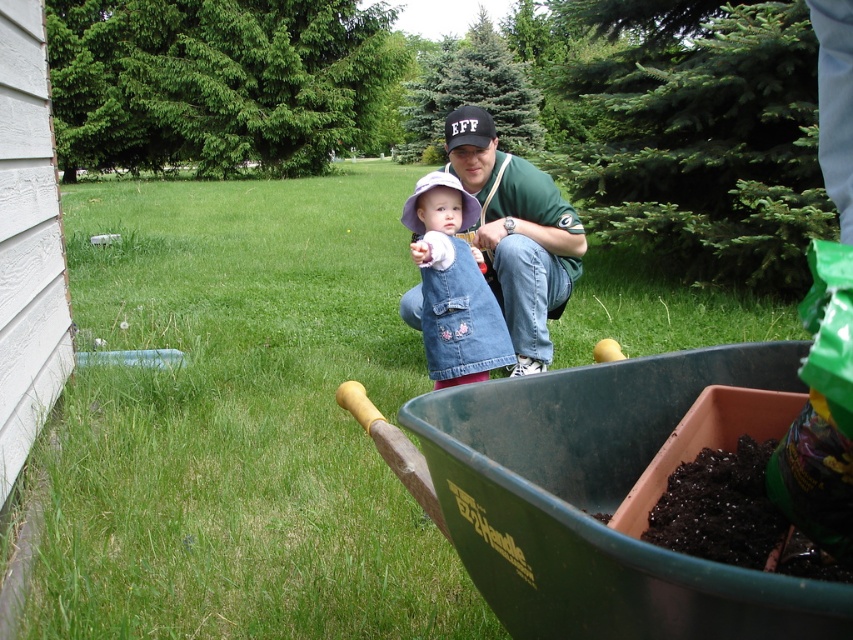
Question: Based on their relative distances, which object is farther from the green grass at lower left?

Choices:
 (A) denim vest at center
 (B) green jersey at center

Answer: (B)

Question: Is green grass at lower left positioned before green jersey at center?

Choices:
 (A) no
 (B) yes

Answer: (B)

Question: Which point appears farthest from the camera in this image?

Choices:
 (A) (534, 346)
 (B) (427, 211)

Answer: (A)

Question: Is green grass at lower left thinner than denim vest at center?

Choices:
 (A) no
 (B) yes

Answer: (A)

Question: Which point is closer to the camera?

Choices:
 (A) (466, 259)
 (B) (492, 230)
 (C) (219, 588)

Answer: (C)

Question: From the image, what is the correct spatial relationship of green grass at lower left in relation to denim vest at center?

Choices:
 (A) right
 (B) left

Answer: (B)